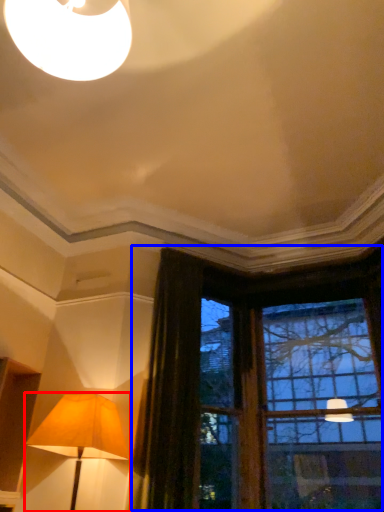
Question: Among these objects, which one is farthest to the camera, lamp (highlighted by a red box) or window (highlighted by a blue box)?

Choices:
 (A) lamp
 (B) window

Answer: (B)